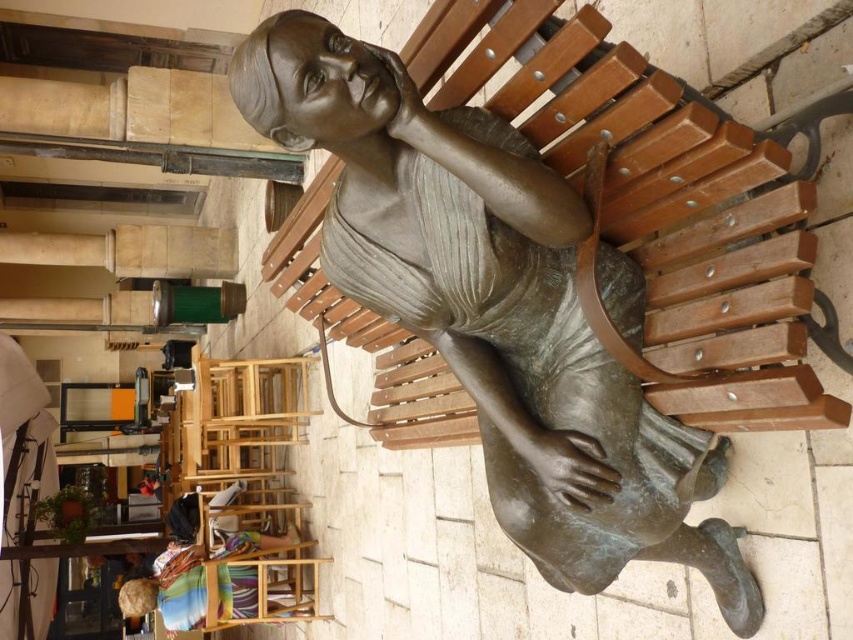
You are an artist planning to create a sculpture that matches the proportions of the bronze statue at center and the multicolored fabric at lower left. Which object should you use as a reference for the thinner dimension?

The bronze statue at center is thinner than the multicolored fabric at lower left, so you should use the bronze statue at center as the reference for the thinner dimension.

You are standing at the entrance of the plaza facing the bronze statue at center. If you walk straight ahead, will you approach the statue directly?

Yes, since the bronze statue at center is located at point (494, 308), walking straight ahead from the entrance would lead you directly toward the statue.